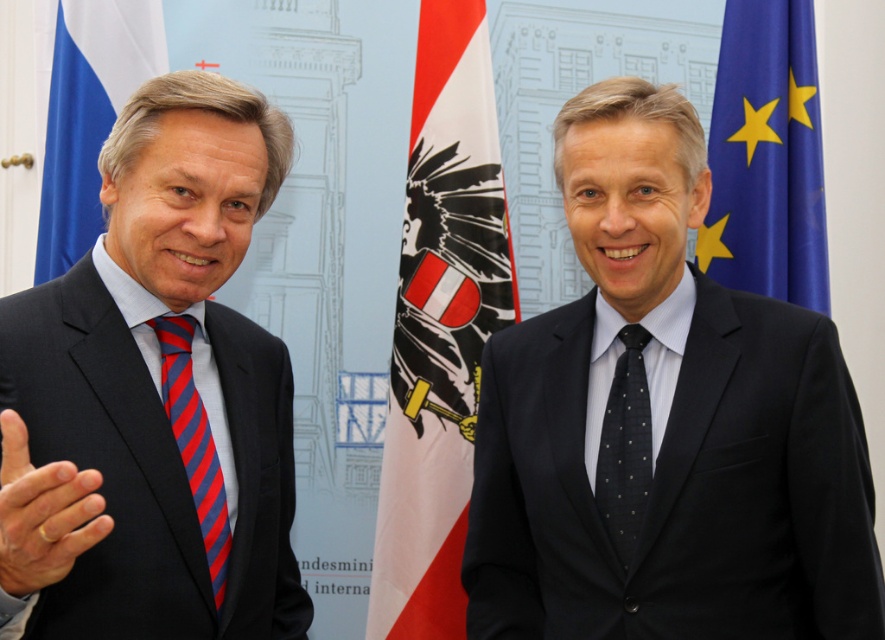
Question: Which object is positioned farthest from the blue fabric flag at right?

Choices:
 (A) dark gray dotted tie at center
 (B) white/red fabric flag at center

Answer: (A)

Question: Which point is closer to the camera taking this photo?

Choices:
 (A) (717, 97)
 (B) (499, 410)
 (C) (42, 470)
 (D) (439, 369)

Answer: (C)

Question: Can you confirm if blue fabric flag at left is thinner than red striped tie at left?

Choices:
 (A) yes
 (B) no

Answer: (B)

Question: Which object is the farthest from the matte black suit at left?

Choices:
 (A) dark blue suit at right
 (B) white/red fabric flag at center
 (C) red striped tie at left

Answer: (B)

Question: Is white/red fabric flag at center further to the viewer compared to blue fabric flag at left?

Choices:
 (A) no
 (B) yes

Answer: (B)

Question: Can you confirm if matte black suit at left is positioned to the left of dark gray dotted tie at center?

Choices:
 (A) yes
 (B) no

Answer: (A)